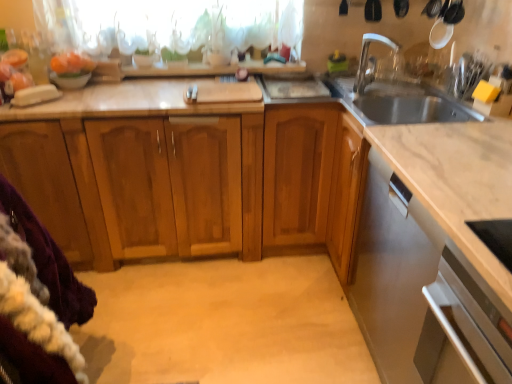
Locate an element on the screen. This screenshot has width=512, height=384. free space above satin silver dishwasher at lower right (from a real-world perspective) is located at coordinates (466, 159).